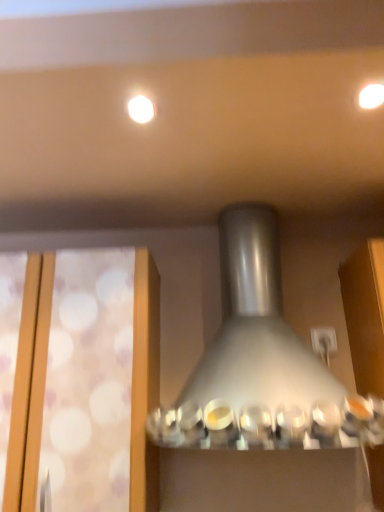
Question: Would you consider white glossy light fixture at upper center, the second lighting in the right-to-left sequence, to be distant from satin silver lamp at center?

Choices:
 (A) no
 (B) yes

Answer: (A)

Question: Is the depth of white glossy light fixture at upper center, which is the 1th lighting from left to right, greater than that of satin silver lamp at center?

Choices:
 (A) no
 (B) yes

Answer: (B)

Question: Is satin silver lamp at center surrounded by white glossy light fixture at upper center, the second lighting in the right-to-left sequence?

Choices:
 (A) no
 (B) yes

Answer: (A)

Question: From the image's perspective, is white glossy light fixture at upper center, the second lighting in the right-to-left sequence, under satin silver lamp at center?

Choices:
 (A) no
 (B) yes

Answer: (A)

Question: From a real-world perspective, does white glossy light fixture at upper center, the second lighting in the right-to-left sequence, stand above satin silver lamp at center?

Choices:
 (A) no
 (B) yes

Answer: (B)

Question: Relative to satin silver lamp at center, is translucent frosted glass at left in front or behind?

Choices:
 (A) front
 (B) behind

Answer: (B)

Question: Is translucent frosted glass at left inside or outside of satin silver lamp at center?

Choices:
 (A) outside
 (B) inside

Answer: (A)

Question: From their relative heights in the image, would you say translucent frosted glass at left is taller or shorter than satin silver lamp at center?

Choices:
 (A) short
 (B) tall

Answer: (B)

Question: Considering the positions of point (140, 473) and point (311, 415), is point (140, 473) closer or farther from the camera than point (311, 415)?

Choices:
 (A) farther
 (B) closer

Answer: (A)

Question: From the image's perspective, relative to white glossy light fixture at upper center, the second lighting in the right-to-left sequence, is matte white light at upper right, the second lighting from the left, above or below?

Choices:
 (A) below
 (B) above

Answer: (B)

Question: From a real-world perspective, is matte white light at upper right, which is the 1th lighting in right-to-left order, physically located above or below white glossy light fixture at upper center, the second lighting in the right-to-left sequence?

Choices:
 (A) above
 (B) below

Answer: (A)

Question: Considering the positions of matte white light at upper right, the second lighting from the left, and white glossy light fixture at upper center, the second lighting in the right-to-left sequence, in the image, is matte white light at upper right, the second lighting from the left, wider or thinner than white glossy light fixture at upper center, the second lighting in the right-to-left sequence,?

Choices:
 (A) wide
 (B) thin

Answer: (A)

Question: Is matte white light at upper right, which is the 1th lighting in right-to-left order, in front of or behind white glossy light fixture at upper center, the second lighting in the right-to-left sequence, in the image?

Choices:
 (A) front
 (B) behind

Answer: (A)

Question: Is point (16, 380) positioned closer to the camera than point (135, 114)?

Choices:
 (A) farther
 (B) closer

Answer: (A)

Question: Is translucent frosted glass at left spatially inside white glossy light fixture at upper center, the second lighting in the right-to-left sequence, or outside of it?

Choices:
 (A) inside
 (B) outside

Answer: (B)